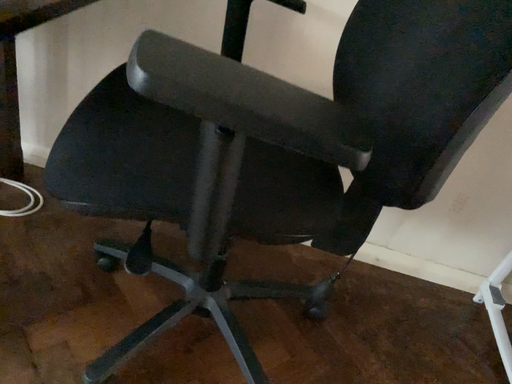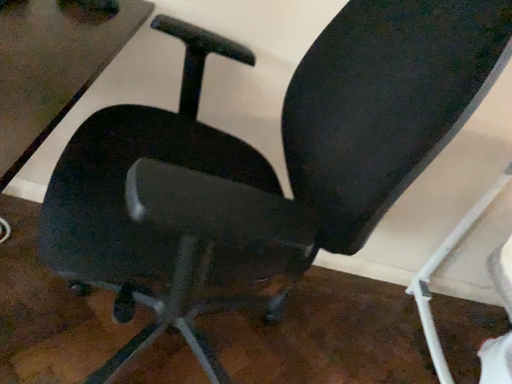
Question: How did the camera likely rotate when shooting the video?

Choices:
 (A) rotated left
 (B) rotated right

Answer: (B)